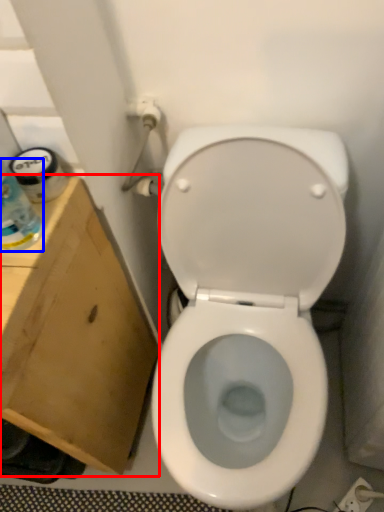
Question: Among these objects, which one is nearest to the camera, cardboard box (highlighted by a red box) or bottle (highlighted by a blue box)?

Choices:
 (A) cardboard box
 (B) bottle

Answer: (B)